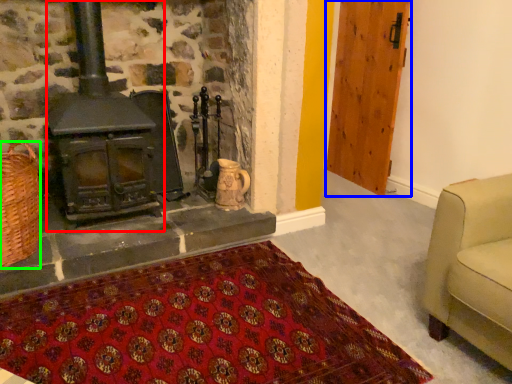
Question: Which is farther away from wood burning stove (highlighted by a red box)? door (highlighted by a blue box) or basket (highlighted by a green box)?

Choices:
 (A) door
 (B) basket

Answer: (A)